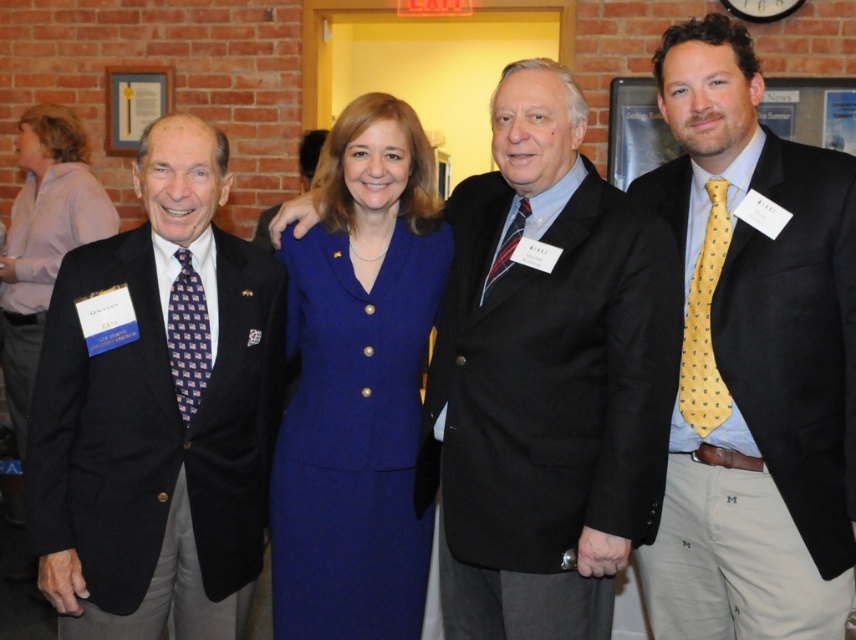
Does matte black suit at right have a lesser height compared to blue fabric dress at center?

No.

The height and width of the screenshot is (640, 856). What do you see at coordinates (752, 362) in the screenshot?
I see `matte black suit at right` at bounding box center [752, 362].

Find the location of a particular element. matte black suit at right is located at coordinates (752, 362).

Who is shorter, yellow dotted tie at right or striped silk tie at center?

striped silk tie at center is shorter.

Is point (706, 189) more distant than point (500, 268)?

Yes.

Where is `yellow dotted tie at right`? yellow dotted tie at right is located at coordinates (704, 323).

Find the location of a particular element. yellow dotted tie at right is located at coordinates (704, 323).

Where is `blue woolen suit at center`? The width and height of the screenshot is (856, 640). blue woolen suit at center is located at coordinates (358, 385).

Can you confirm if blue woolen suit at center is taller than blue fabric dress at center?

No.

Find the location of a particular element. Image resolution: width=856 pixels, height=640 pixels. blue woolen suit at center is located at coordinates (358, 385).